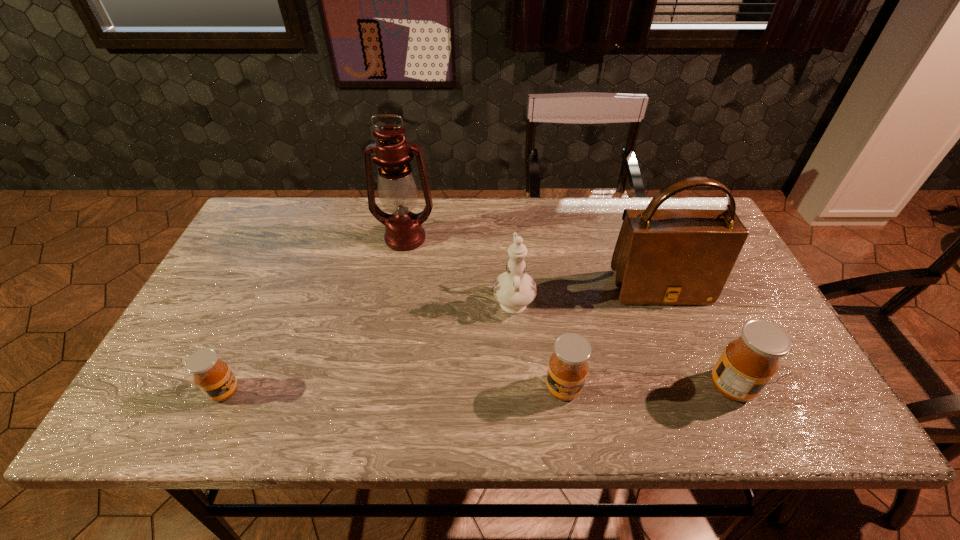
Locate an element on the screen. The height and width of the screenshot is (540, 960). shoulder bag present at the right edge is located at coordinates (662, 256).

Identify the location of object that is positioned at the near left corner. Image resolution: width=960 pixels, height=540 pixels. (214, 378).

This screenshot has width=960, height=540. In order to click on object at the near right corner in this screenshot , I will do `click(748, 363)`.

At what (x,y) coordinates should I click in order to perform the action: click on vacant space at the far edge of the desktop. Please return your answer as a coordinate pair (x, y). The height and width of the screenshot is (540, 960). Looking at the image, I should click on (561, 210).

Where is `free space at the left edge`? This screenshot has width=960, height=540. free space at the left edge is located at coordinates (211, 327).

Image resolution: width=960 pixels, height=540 pixels. In the image, there is a desktop. Find the location of `free space at the far left corner`. free space at the far left corner is located at coordinates (299, 228).

This screenshot has width=960, height=540. What are the coordinates of `vacant space at the near right corner` in the screenshot? It's located at (782, 380).

At what (x,y) coordinates should I click in order to perform the action: click on empty space between the farthest object and the shortest honey. Please return your answer as a coordinate pair (x, y). Looking at the image, I should click on (315, 315).

You are a GUI agent. You are given a task and a screenshot of the screen. Output one action in this format:
    pyautogui.click(x=<x>, y=<y>)
    Task: Click on the free area in between the second tallest object and the shortest object
    The image size is (960, 540).
    Given the screenshot: What is the action you would take?
    pyautogui.click(x=442, y=340)

You are a GUI agent. You are given a task and a screenshot of the screen. Output one action in this format:
    pyautogui.click(x=<x>, y=<y>)
    Task: Click on the vacant region between the second honey from right to left and the chinaware
    The image size is (960, 540).
    Given the screenshot: What is the action you would take?
    pyautogui.click(x=539, y=343)